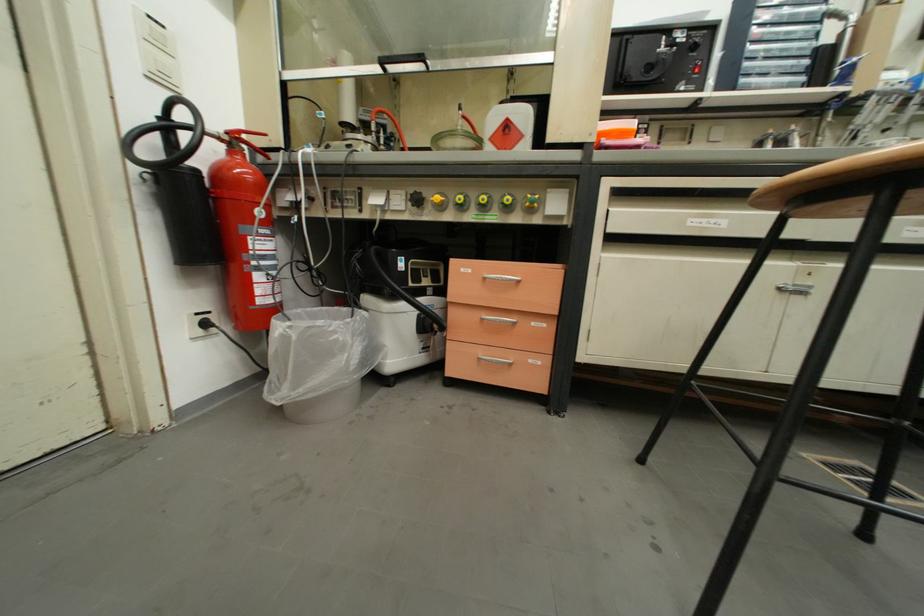
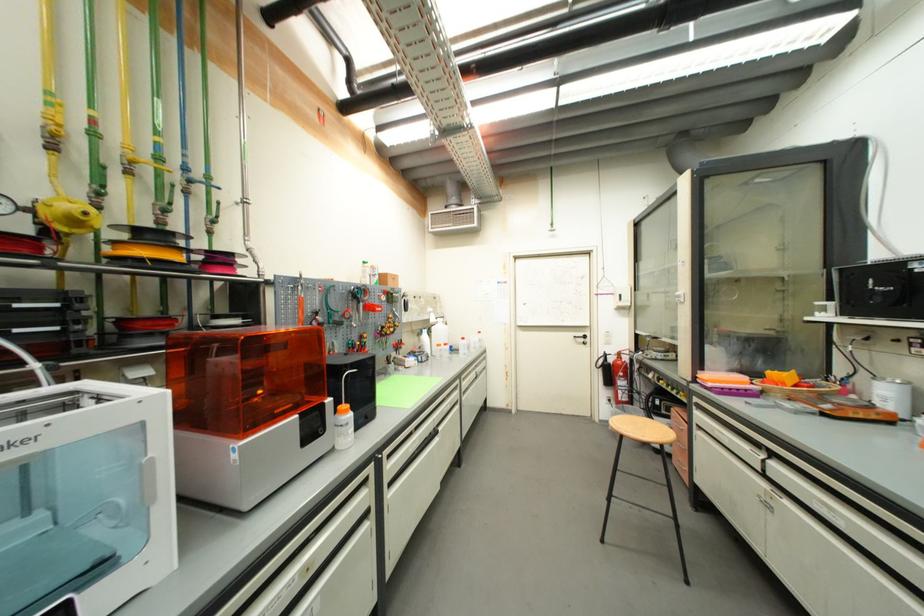
Find the pixel in the second image that matches (x=265, y=215) in the first image.

(626, 376)